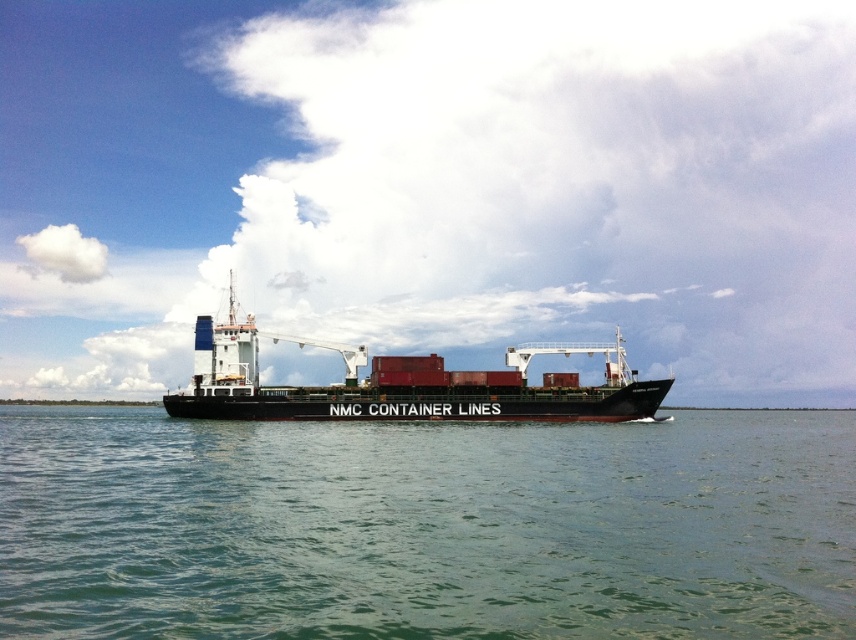
Does green water at center appear over black matte container ship at center?

Actually, green water at center is below black matte container ship at center.

Based on the photo, which is more to the right, green water at center or black matte container ship at center?

From the viewer's perspective, green water at center appears more on the right side.

Who is more forward, (x=105, y=525) or (x=634, y=372)?

Point (x=105, y=525) is in front.

This screenshot has height=640, width=856. Identify the location of green water at center. (425, 525).